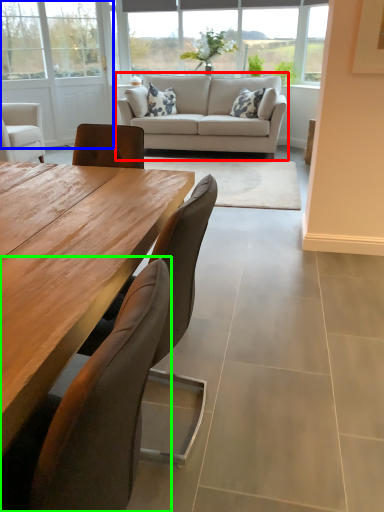
Question: Considering the real-world distances, which object is farthest from studio couch (highlighted by a red box)? screen door (highlighted by a blue box) or chair (highlighted by a green box)?

Choices:
 (A) screen door
 (B) chair

Answer: (B)